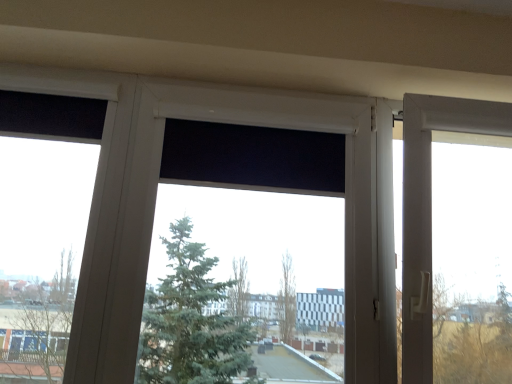
Where is `white plastic window frame at left`? white plastic window frame at left is located at coordinates (73, 96).

This screenshot has height=384, width=512. What do you see at coordinates (73, 96) in the screenshot?
I see `white plastic window frame at left` at bounding box center [73, 96].

The width and height of the screenshot is (512, 384). I want to click on white plastic window frame at left, so click(73, 96).